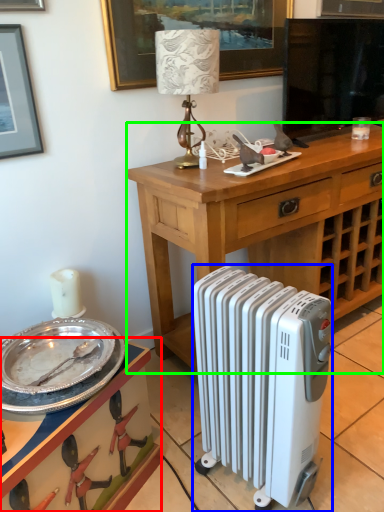
Question: Considering the real-world distances, which object is farthest from vanity (highlighted by a red box)? radiator (highlighted by a blue box) or desk (highlighted by a green box)?

Choices:
 (A) radiator
 (B) desk

Answer: (B)